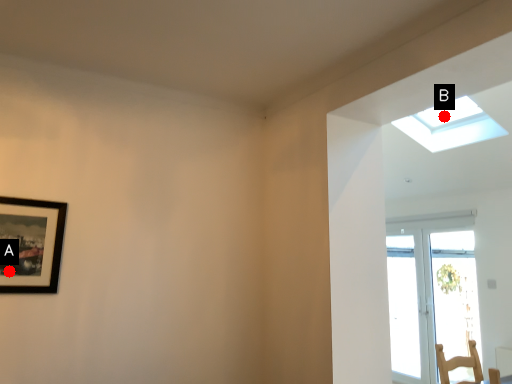
Question: Two points are circled on the image, labeled by A and B beside each circle. Which point is further to the camera?

Choices:
 (A) A is further
 (B) B is further

Answer: (B)